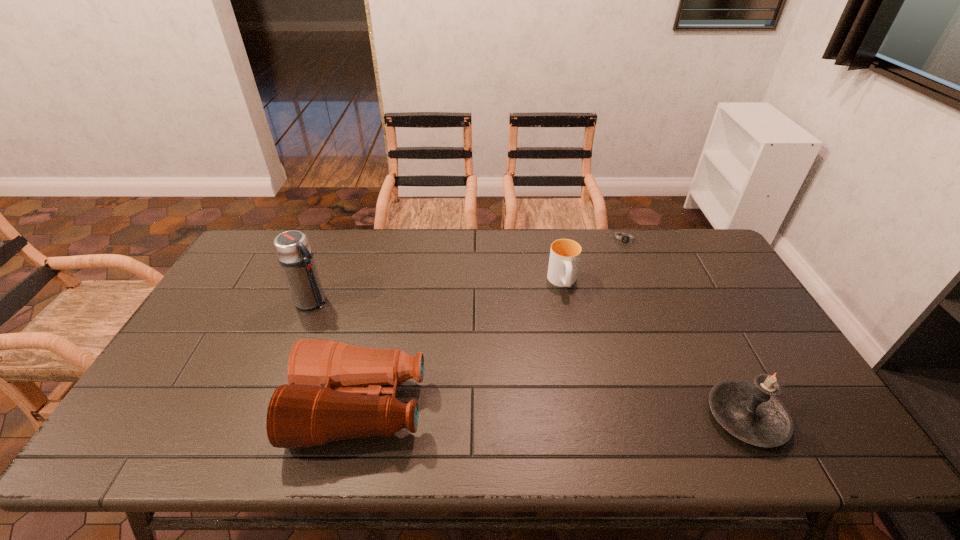
Locate an element on the screen. Image resolution: width=960 pixels, height=540 pixels. free space at the left edge of the desktop is located at coordinates (239, 338).

Identify the location of vacant space at the right edge of the desktop. The image size is (960, 540). (715, 281).

Identify the location of vacant region at the far right corner. The height and width of the screenshot is (540, 960). (684, 242).

Identify the location of free area in between the binoculars and the third object from left to right. (462, 345).

Identify the location of vacant space that is in between the candle and the watch. (685, 328).

Locate an element on the screen. vacant space in between the second tallest object and the binoculars is located at coordinates (553, 413).

Where is `vacant area between the thermos bottle and the candle`? This screenshot has width=960, height=540. vacant area between the thermos bottle and the candle is located at coordinates (529, 359).

At what (x,y) coordinates should I click in order to perform the action: click on free area in between the watch and the fourth shortest object. Please return your answer as a coordinate pair (x, y). The height and width of the screenshot is (540, 960). Looking at the image, I should click on pyautogui.click(x=685, y=328).

What are the coordinates of `free space between the third tallest object and the candle` in the screenshot? It's located at (553, 413).

Find the location of a particular element. This screenshot has height=540, width=960. vacant space that is in between the watch and the second shortest object is located at coordinates (594, 261).